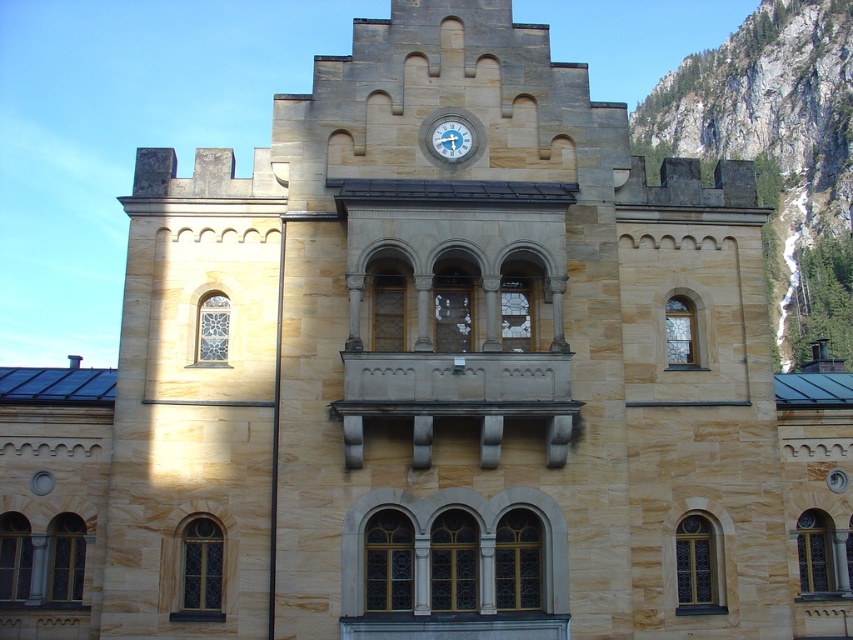
Question: Among these points, which one is nearest to the camera?

Choices:
 (A) (463, 132)
 (B) (833, 195)

Answer: (A)

Question: Which point is closer to the camera?

Choices:
 (A) (802, 248)
 (B) (457, 129)

Answer: (B)

Question: Which point is farther to the camera?

Choices:
 (A) metallic gray clock at upper center
 (B) rocky cliff at upper right

Answer: (B)

Question: Can you confirm if rocky cliff at upper right is positioned to the left of metallic gray clock at upper center?

Choices:
 (A) yes
 (B) no

Answer: (B)

Question: Is rocky cliff at upper right closer to the viewer compared to metallic gray clock at upper center?

Choices:
 (A) yes
 (B) no

Answer: (B)

Question: Can you confirm if rocky cliff at upper right is bigger than metallic gray clock at upper center?

Choices:
 (A) yes
 (B) no

Answer: (A)